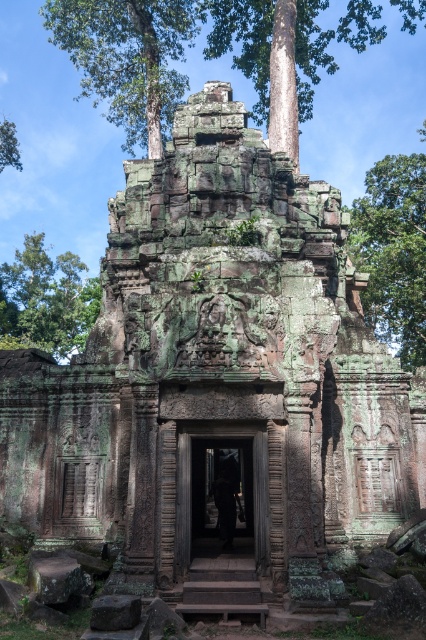
Question: Is green textured stone at upper center to the right of carved stone doorway at center from the viewer's perspective?

Choices:
 (A) no
 (B) yes

Answer: (A)

Question: Based on their relative distances, which object is farther from the green mossy tree at upper right?

Choices:
 (A) green textured stone at upper center
 (B) green mossy tree at upper left
 (C) carved stone doorway at center
 (D) green mossy tree at left

Answer: (C)

Question: Which of the following is the closest to the observer?

Choices:
 (A) (5, 145)
 (B) (40, 240)
 (C) (154, 42)

Answer: (C)

Question: Among these points, which one is nearest to the camera?

Choices:
 (A) (362, 230)
 (B) (5, 148)

Answer: (A)

Question: Is the position of green mossy stone at upper center less distant than that of carved stone doorway at center?

Choices:
 (A) yes
 (B) no

Answer: (B)

Question: Does green textured stone at upper center have a smaller size compared to green mossy tree at upper left?

Choices:
 (A) yes
 (B) no

Answer: (B)